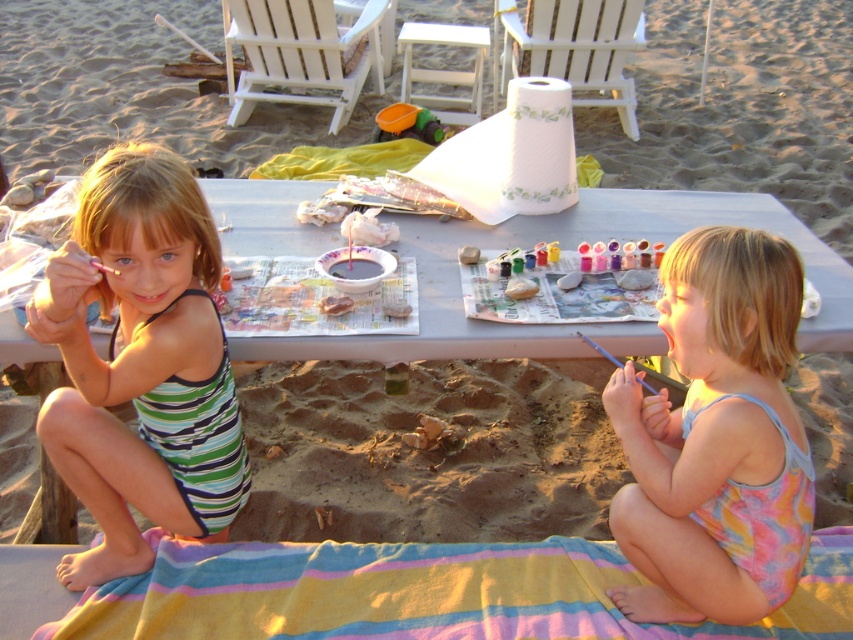
Question: Is striped cotton towel at lower center behind blue plastic paint brush at lower right?

Choices:
 (A) yes
 (B) no

Answer: (A)

Question: Does striped cotton towel at lower center have a lesser width compared to blue plastic paint brush at lower right?

Choices:
 (A) no
 (B) yes

Answer: (A)

Question: Among these points, which one is nearest to the camera?

Choices:
 (A) (115, 272)
 (B) (775, 348)

Answer: (B)

Question: Which object is farther from the camera taking this photo?

Choices:
 (A) striped cotton towel at lower center
 (B) pastel tie-dye swimsuit at lower right
 (C) white plastic picnic table at center

Answer: (C)

Question: Is blue plastic paint brush at lower right above matte pink paintbrush at upper left?

Choices:
 (A) no
 (B) yes

Answer: (A)

Question: Which object appears closest to the camera in this image?

Choices:
 (A) striped cotton towel at lower center
 (B) striped fabric swimsuit at left
 (C) matte pink paintbrush at upper left

Answer: (B)